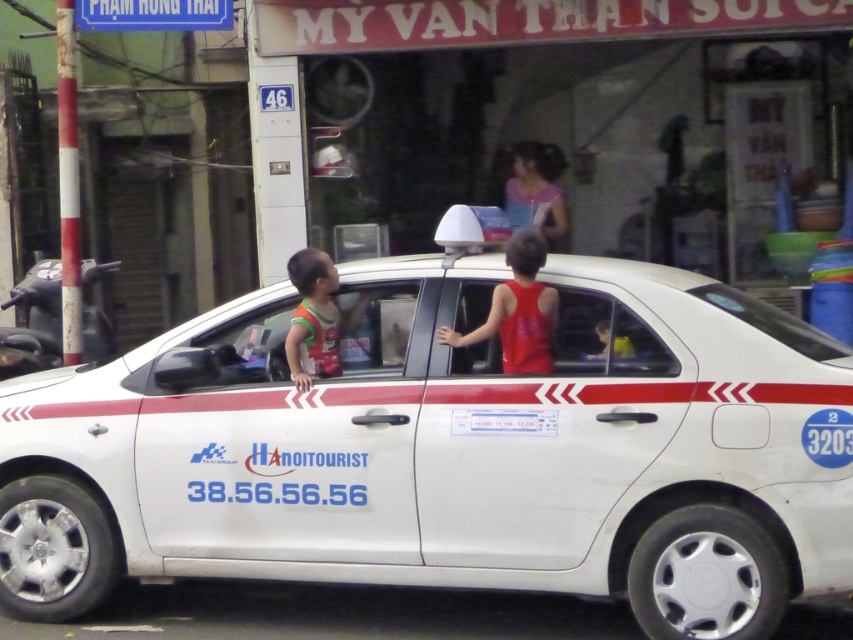
Question: Can you confirm if white matte taxi at center is positioned above orange fabric vest at center?

Choices:
 (A) yes
 (B) no

Answer: (B)

Question: Which point is farther to the camera?

Choices:
 (A) (x=312, y=355)
 (B) (x=532, y=147)

Answer: (B)

Question: Is red matte tank top at center positioned behind yellow fabric shirt at center?

Choices:
 (A) no
 (B) yes

Answer: (B)

Question: Which point is farther from the camera taking this photo?

Choices:
 (A) (543, 182)
 (B) (595, 328)
 (C) (315, 323)

Answer: (A)

Question: Which point is farther to the camera?

Choices:
 (A) pink fabric shirt at upper center
 (B) white matte taxi at center
 (C) yellow fabric shirt at center

Answer: (A)

Question: Does orange fabric vest at center have a larger size compared to pink fabric shirt at upper center?

Choices:
 (A) no
 (B) yes

Answer: (A)